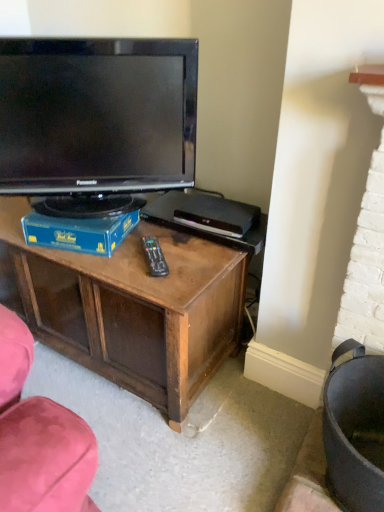
Question: From their relative heights in the image, would you say blue cardboard box at center is taller or shorter than black glossy television at upper left?

Choices:
 (A) tall
 (B) short

Answer: (B)

Question: Considering the positions of blue cardboard box at center and black glossy television at upper left in the image, is blue cardboard box at center wider or thinner than black glossy television at upper left?

Choices:
 (A) wide
 (B) thin

Answer: (A)

Question: Estimate the real-world distances between objects in this image. Which object is farther from the black plastic remote at center?

Choices:
 (A) blue cardboard box at center
 (B) black glossy television at upper left

Answer: (B)

Question: Which object is the farthest from the black glossy television at upper left?

Choices:
 (A) black plastic remote at center
 (B) blue cardboard box at center

Answer: (A)